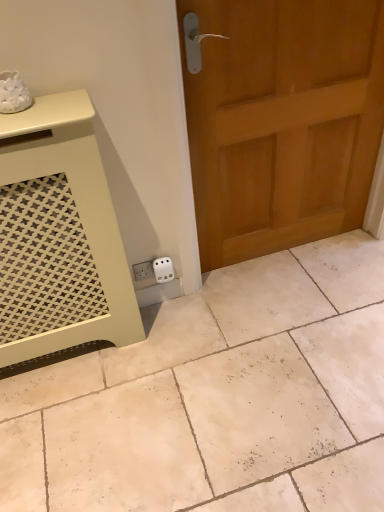
Find the location of a particular element. Image resolution: width=384 pixels, height=512 pixels. wooden door at right is located at coordinates pos(282,121).

Where is `white matte tile at lower left`? This screenshot has width=384, height=512. white matte tile at lower left is located at coordinates (218, 398).

What do you see at coordinates (218, 398) in the screenshot? The width and height of the screenshot is (384, 512). I see `white matte tile at lower left` at bounding box center [218, 398].

I want to click on white plastic electric outlet at lower center, so click(x=163, y=269).

Is matte cream vanity at lower left oriented away from white plastic electric outlet at lower center?

matte cream vanity at lower left does not have its back to white plastic electric outlet at lower center.

Considering the relative sizes of matte cream vanity at lower left and white plastic electric outlet at lower center in the image provided, is matte cream vanity at lower left smaller than white plastic electric outlet at lower center?

No.

Find the location of `electric outlet to the right of matte cream vanity at lower left`. electric outlet to the right of matte cream vanity at lower left is located at coordinates (163, 269).

How far apart are matte cream vanity at lower left and white plastic electric outlet at lower center?

46.74 centimeters.

Is white plastic electric outlet at lower center spatially inside wooden door at right, or outside of it?

The correct answer is: outside.

Considering the relative sizes of white plastic electric outlet at lower center and wooden door at right in the image provided, is white plastic electric outlet at lower center bigger than wooden door at right?

No.

Which object is wider, white plastic electric outlet at lower center or wooden door at right?

Wider between the two is wooden door at right.

Considering the sizes of white plastic electric outlet at lower center and wooden door at right in the image, is white plastic electric outlet at lower center taller or shorter than wooden door at right?

In the image, white plastic electric outlet at lower center appears to be shorter than wooden door at right.

Based on the photo, considering the sizes of white matte tile at lower left and wooden door at right in the image, is white matte tile at lower left bigger or smaller than wooden door at right?

In the image, white matte tile at lower left appears to be smaller than wooden door at right.

Would you say white matte tile at lower left is outside wooden door at right?

Absolutely, white matte tile at lower left is external to wooden door at right.

At what (x,y) coordinates should I click in order to perform the action: click on door lying behind the white matte tile at lower left. Please return your answer as a coordinate pair (x, y). Looking at the image, I should click on (282, 121).

Which is nearer, (200, 301) or (300, 210)?

The point (200, 301) is in front.

Which object is positioned more to the left, white plastic electric outlet at lower center or matte cream vanity at lower left?

From the viewer's perspective, matte cream vanity at lower left appears more on the left side.

Is white plastic electric outlet at lower center in front of matte cream vanity at lower left?

No, it is behind matte cream vanity at lower left.

From the image's perspective, who appears lower, white plastic electric outlet at lower center or matte cream vanity at lower left?

From the image's view, white plastic electric outlet at lower center is below.

Based on the photo, would you consider white plastic electric outlet at lower center to be distant from matte cream vanity at lower left?

Actually, white plastic electric outlet at lower center and matte cream vanity at lower left are a little close together.

Is matte cream vanity at lower left facing away from wooden door at right?

No, matte cream vanity at lower left's orientation is not away from wooden door at right.

Is matte cream vanity at lower left closer to camera compared to wooden door at right?

Yes, matte cream vanity at lower left is in front of wooden door at right.

From the picture: Considering the relative positions of matte cream vanity at lower left and wooden door at right in the image provided, is matte cream vanity at lower left to the left or to the right of wooden door at right?

From the image, it's evident that matte cream vanity at lower left is to the left of wooden door at right.

Does matte cream vanity at lower left have a lesser height compared to white matte tile at lower left?

In fact, matte cream vanity at lower left may be taller than white matte tile at lower left.

Considering the points (20, 126) and (140, 501), which point is in front, point (20, 126) or point (140, 501)?

The point (20, 126) is closer.

Can you see matte cream vanity at lower left touching white matte tile at lower left?

No, matte cream vanity at lower left is not next to white matte tile at lower left.

The image size is (384, 512). What are the coordinates of `vanity located above the white matte tile at lower left (from the image's perspective)` in the screenshot? It's located at (59, 234).

Considering the sizes of objects wooden door at right and matte cream vanity at lower left in the image provided, who is thinner, wooden door at right or matte cream vanity at lower left?

With smaller width is wooden door at right.

Considering the sizes of wooden door at right and matte cream vanity at lower left in the image, is wooden door at right bigger or smaller than matte cream vanity at lower left?

In the image, wooden door at right appears to be larger than matte cream vanity at lower left.

From their relative heights in the image, would you say wooden door at right is taller or shorter than matte cream vanity at lower left?

In the image, wooden door at right appears to be taller than matte cream vanity at lower left.

The height and width of the screenshot is (512, 384). I want to click on vanity that appears below the wooden door at right (from a real-world perspective), so click(59, 234).

What are the coordinates of `vanity in front of the white plastic electric outlet at lower center` in the screenshot? It's located at (59, 234).

You are a GUI agent. You are given a task and a screenshot of the screen. Output one action in this format:
    pyautogui.click(x=<x>, y=<y>)
    Task: Click on the electric outlet below the wooden door at right (from the image's perspective)
    Image resolution: width=384 pixels, height=512 pixels.
    Given the screenshot: What is the action you would take?
    pyautogui.click(x=163, y=269)

Based on their spatial positions, is white plastic electric outlet at lower center or white matte tile at lower left closer to matte cream vanity at lower left?

Among the two, white plastic electric outlet at lower center is located nearer to matte cream vanity at lower left.

Looking at the image, which one is located closer to matte cream vanity at lower left, white matte tile at lower left or white plastic electric outlet at lower center?

white plastic electric outlet at lower center is positioned closer to the anchor matte cream vanity at lower left.

Looking at the image, which one is located further to white plastic electric outlet at lower center, white matte tile at lower left or wooden door at right?

Based on the image, wooden door at right appears to be further to white plastic electric outlet at lower center.

From the image, which object appears to be farther from matte cream vanity at lower left, white matte tile at lower left or wooden door at right?

wooden door at right is further to matte cream vanity at lower left.

Looking at the image, which one is located further to white matte tile at lower left, white plastic electric outlet at lower center or wooden door at right?

Among the two, wooden door at right is located further to white matte tile at lower left.

Considering their positions, is white plastic electric outlet at lower center positioned further to matte cream vanity at lower left than wooden door at right?

wooden door at right.

Considering their positions, is wooden door at right positioned closer to white matte tile at lower left than white plastic electric outlet at lower center?

Among the two, white plastic electric outlet at lower center is located nearer to white matte tile at lower left.

Based on their spatial positions, is wooden door at right or white plastic electric outlet at lower center further from matte cream vanity at lower left?

Based on the image, wooden door at right appears to be further to matte cream vanity at lower left.

Where is `ceramic tile situated between matte cream vanity at lower left and wooden door at right from left to right`? ceramic tile situated between matte cream vanity at lower left and wooden door at right from left to right is located at coordinates point(218,398).

At what (x,y) coordinates should I click in order to perform the action: click on electric outlet between matte cream vanity at lower left and wooden door at right in the horizontal direction. Please return your answer as a coordinate pair (x, y). This screenshot has width=384, height=512. Looking at the image, I should click on (163, 269).

Find the location of `ceramic tile positioned between matte cream vanity at lower left and white plastic electric outlet at lower center from near to far`. ceramic tile positioned between matte cream vanity at lower left and white plastic electric outlet at lower center from near to far is located at coordinates (218, 398).

Find the location of a particular element. This screenshot has height=512, width=384. electric outlet between wooden door at right and white matte tile at lower left from top to bottom is located at coordinates (163, 269).